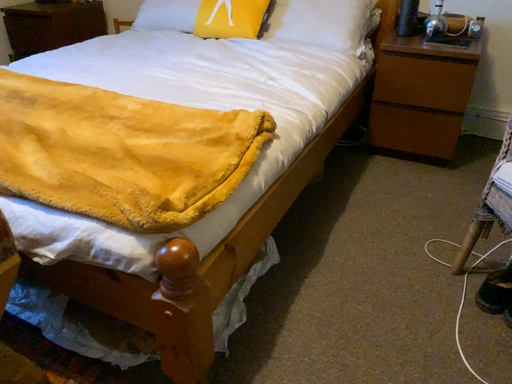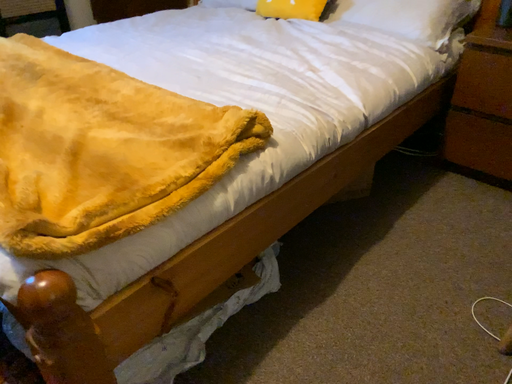
Question: Which way did the camera rotate in the video?

Choices:
 (A) rotated left
 (B) rotated right

Answer: (A)